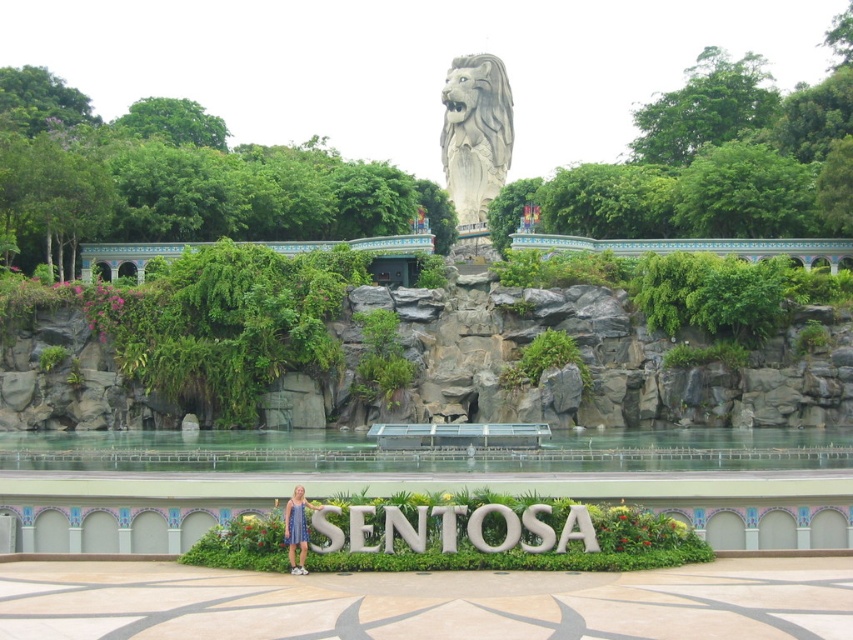
Does gray stone lion at upper center appear on the right side of blue fabric dress at lower center?

Yes, gray stone lion at upper center is to the right of blue fabric dress at lower center.

Measure the distance between gray stone lion at upper center and blue fabric dress at lower center.

gray stone lion at upper center and blue fabric dress at lower center are 110.33 meters apart.

The height and width of the screenshot is (640, 853). What do you see at coordinates (474, 132) in the screenshot?
I see `gray stone lion at upper center` at bounding box center [474, 132].

Find the location of `gray stone lion at upper center`. gray stone lion at upper center is located at coordinates (474, 132).